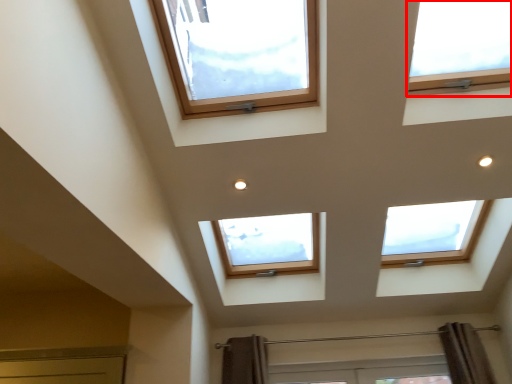
Question: Where is window (annotated by the red box) located in relation to window in the image?

Choices:
 (A) right
 (B) left

Answer: (A)